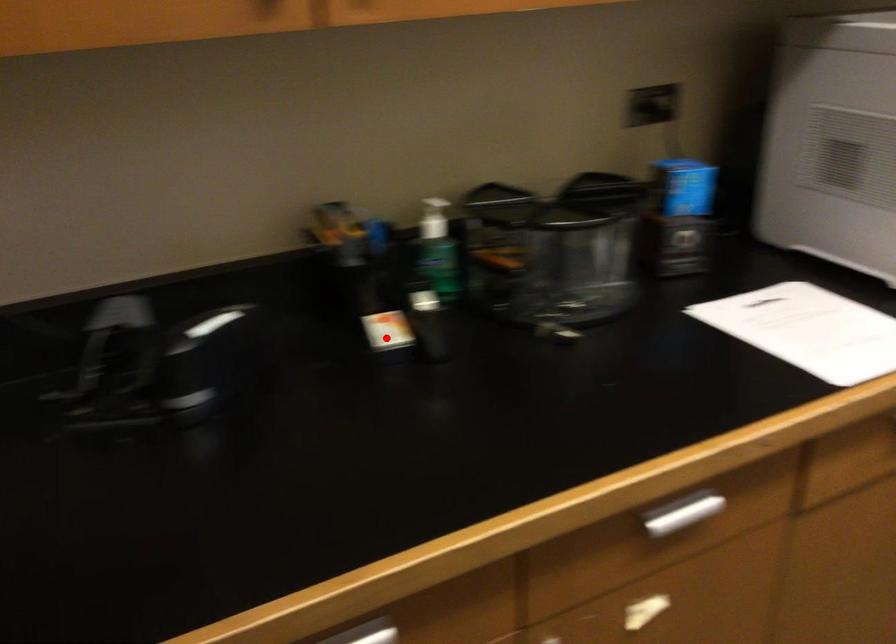
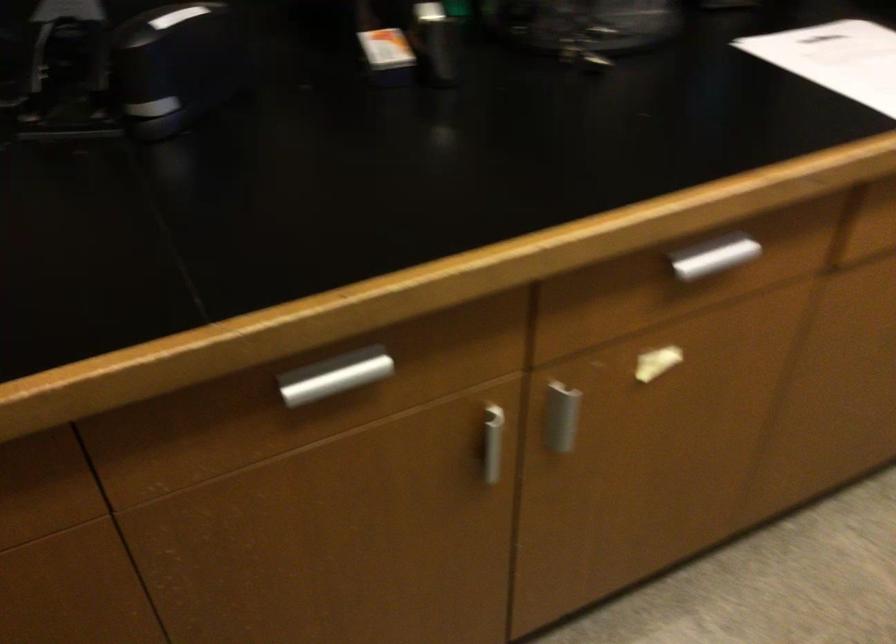
In the second image, find the point that corresponds to the highlighted location in the first image.

(386, 57)